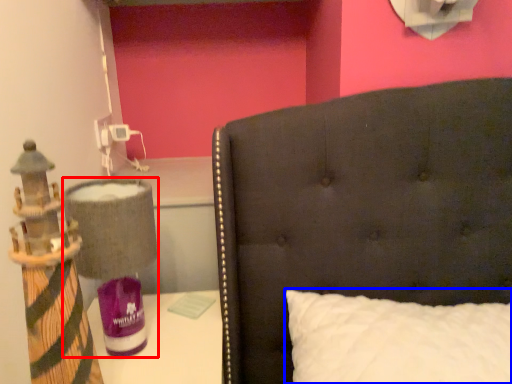
Question: Which of the following is the farthest to the observer, table lamp (highlighted by a red box) or pillow (highlighted by a blue box)?

Choices:
 (A) table lamp
 (B) pillow

Answer: (A)